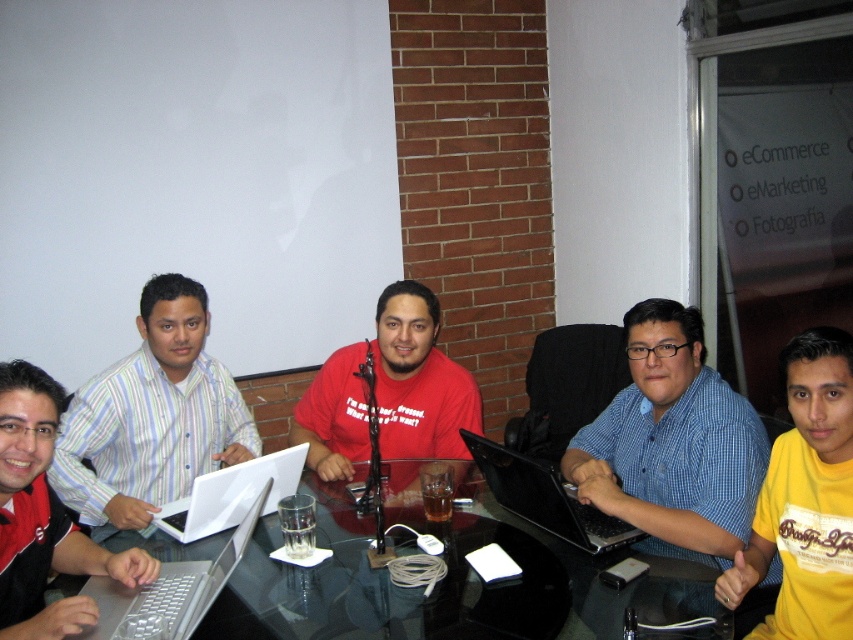
Can you confirm if light blue striped shirt at left is smaller than black glossy laptop at center?

Actually, light blue striped shirt at left might be larger than black glossy laptop at center.

Locate an element on the screen. This screenshot has width=853, height=640. light blue striped shirt at left is located at coordinates (44, 516).

Locate an element on the screen. light blue striped shirt at left is located at coordinates (44, 516).

Locate an element on the screen. This screenshot has width=853, height=640. light blue striped shirt at left is located at coordinates (44, 516).

Can you confirm if striped cotton shirt at left is positioned below matte red shirt at center?

Yes, striped cotton shirt at left is below matte red shirt at center.

Which of these two, striped cotton shirt at left or matte red shirt at center, stands taller?

Standing taller between the two is striped cotton shirt at left.

Describe the element at coordinates (152, 417) in the screenshot. I see `striped cotton shirt at left` at that location.

Locate an element on the screen. The width and height of the screenshot is (853, 640). striped cotton shirt at left is located at coordinates (152, 417).

This screenshot has height=640, width=853. I want to click on striped cotton shirt at left, so click(152, 417).

Can you confirm if striped cotton shirt at left is thinner than silver metallic laptop at lower left?

No.

Is point (84, 413) positioned in front of point (222, 572)?

No.

Locate an element on the screen. striped cotton shirt at left is located at coordinates (152, 417).